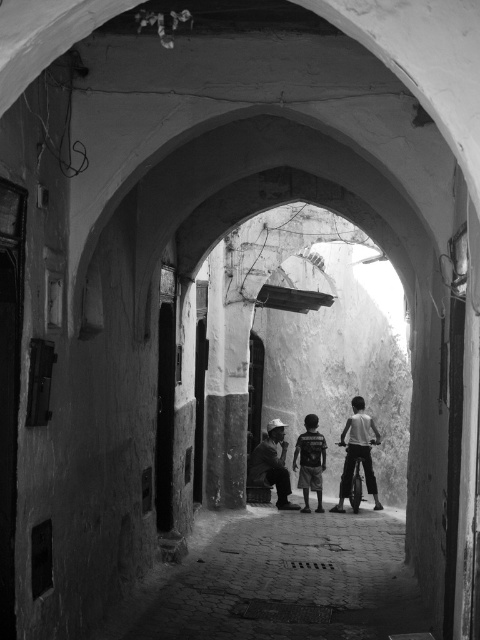
You are a delivery person with a 5.5 feet wide cart. You need to navigate through the narrow alleyway shown in the image. There is a light brown wooden bicycle at center and a smooth fabric shirt at center in the scene. Can your cart fit through the space between these two objects?

The distance between the light brown wooden bicycle at center and the smooth fabric shirt at center is 5.19 feet. Since your cart is 5.5 feet wide, it cannot fit through the space between them as the gap is narrower than the cart.